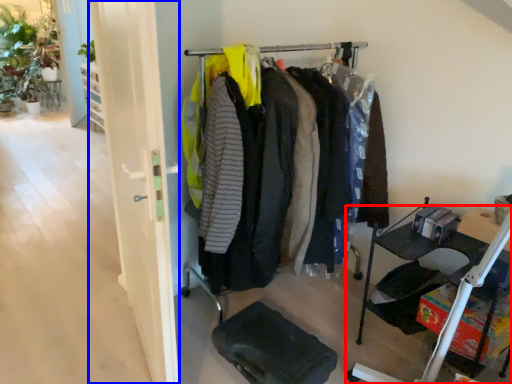
Question: Which object appears farthest to the camera in this image, furniture (highlighted by a red box) or glass door (highlighted by a blue box)?

Choices:
 (A) furniture
 (B) glass door

Answer: (A)